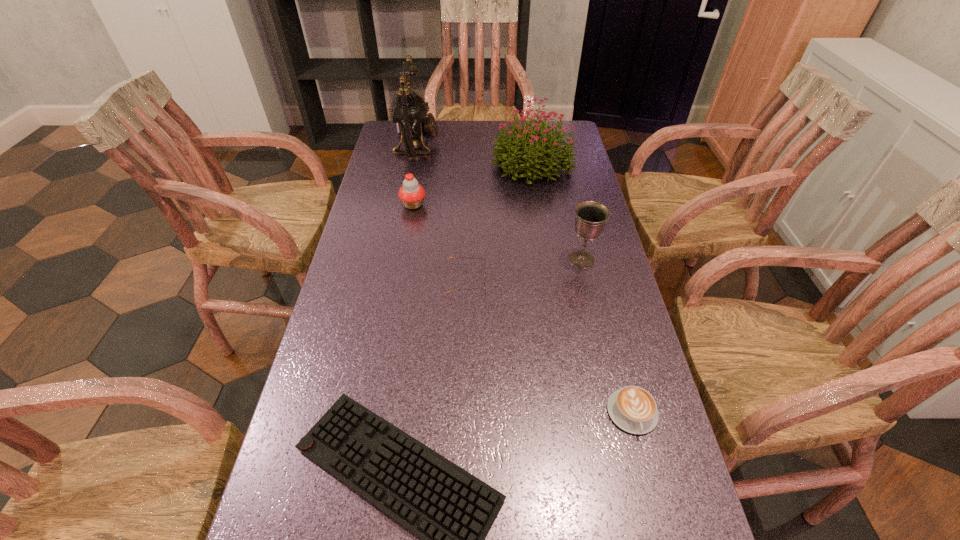
Locate an element on the screen. This screenshot has width=960, height=540. object present at the far left corner is located at coordinates (411, 116).

The image size is (960, 540). I want to click on object located at the far right corner, so click(x=519, y=140).

Locate an element on the screen. This screenshot has width=960, height=540. vacant space at the far edge of the desktop is located at coordinates (447, 132).

Identify the location of vacant area at the left edge. (410, 221).

Where is `free space at the right edge`? The height and width of the screenshot is (540, 960). free space at the right edge is located at coordinates (579, 359).

The width and height of the screenshot is (960, 540). In the image, there is a desktop. In order to click on vacant region at the far left corner in this screenshot , I will do `click(391, 145)`.

Where is `free spot between the fifth tallest object and the cupcake`? free spot between the fifth tallest object and the cupcake is located at coordinates (440, 242).

Find the location of `free space between the spectacles and the fifth nearest object`. free space between the spectacles and the fifth nearest object is located at coordinates (440, 242).

What are the coordinates of `free space that is in between the cappuccino and the bouquet` in the screenshot? It's located at (583, 288).

The width and height of the screenshot is (960, 540). Find the location of `free area in between the fourth shortest object and the second tallest object`. free area in between the fourth shortest object and the second tallest object is located at coordinates (473, 184).